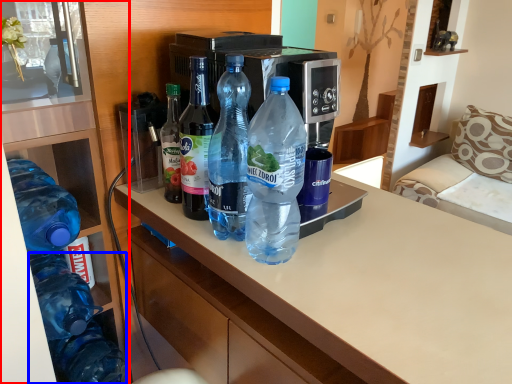
Question: Which point is further to the camera, cabinetry (highlighted by a red box) or bottle (highlighted by a blue box)?

Choices:
 (A) cabinetry
 (B) bottle

Answer: (B)